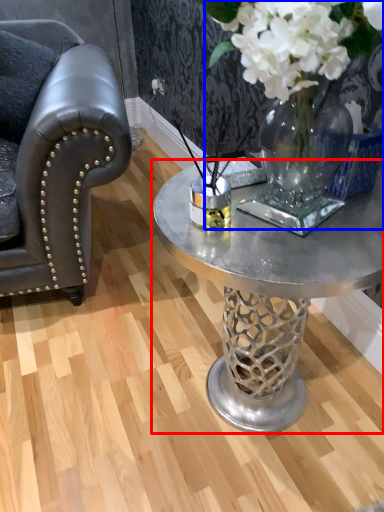
Question: Which object appears closest to the camera in this image, coffee table (highlighted by a red box) or floral arrangement (highlighted by a blue box)?

Choices:
 (A) coffee table
 (B) floral arrangement

Answer: (B)